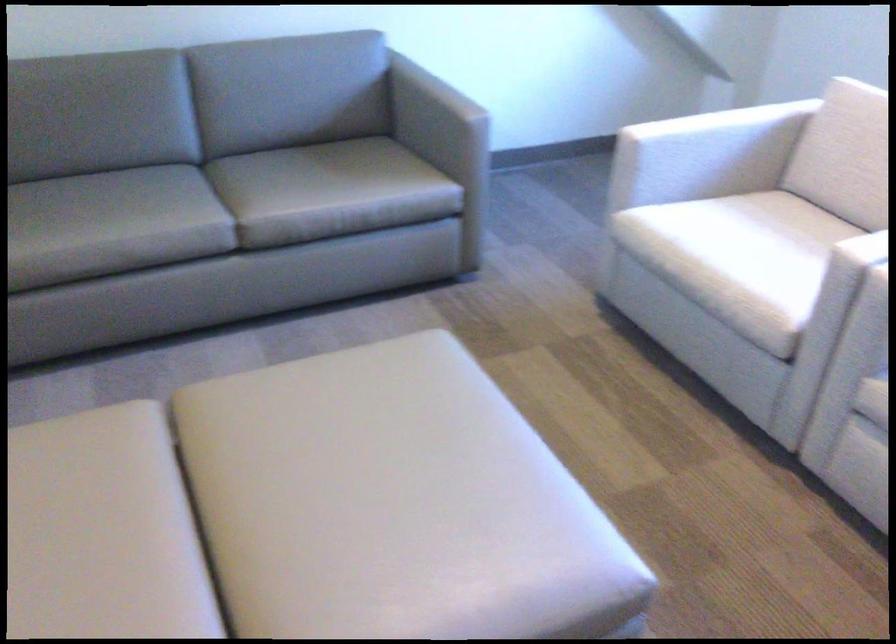
Locate an element on the screen. beige ottoman surface is located at coordinates (348, 446).